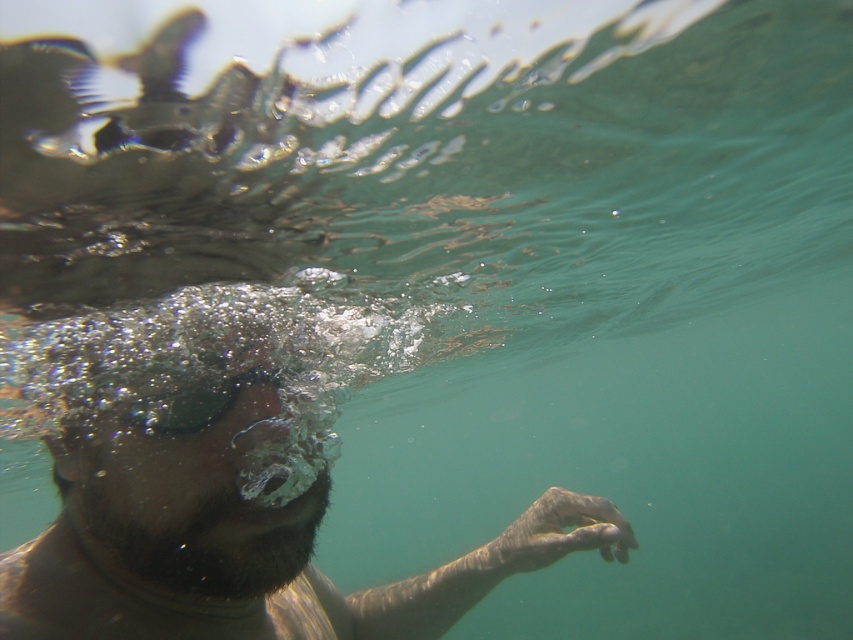
Question: Does brown matte skin at center have a larger size compared to transparent rubber goggles at center?

Choices:
 (A) no
 (B) yes

Answer: (B)

Question: Among these points, which one is nearest to the camera?

Choices:
 (A) (223, 397)
 (B) (109, 324)

Answer: (A)

Question: Can you confirm if brown matte skin at center is bigger than transparent rubber goggles at center?

Choices:
 (A) yes
 (B) no

Answer: (A)

Question: Is brown matte skin at center wider than transparent rubber goggles at center?

Choices:
 (A) no
 (B) yes

Answer: (B)